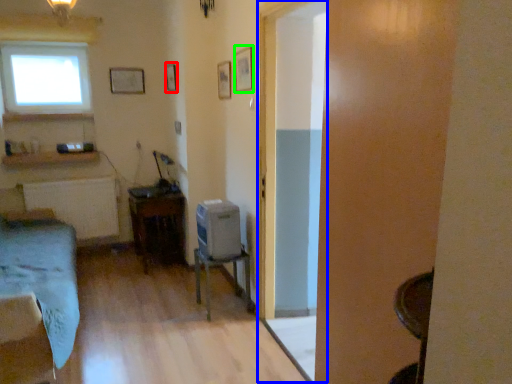
Question: Which is nearer to the picture frame (highlighted by a red box)? glass door (highlighted by a blue box) or picture frame (highlighted by a green box).

Choices:
 (A) glass door
 (B) picture frame

Answer: (B)